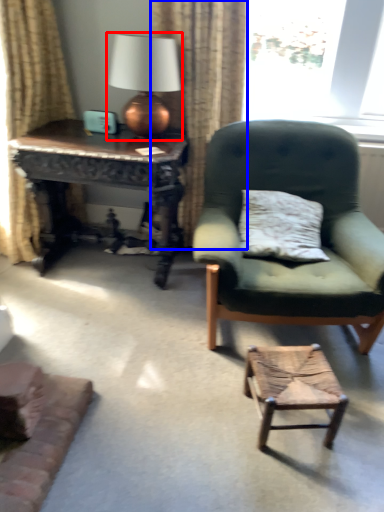
Question: Which object appears closest to the camera in this image, table lamp (highlighted by a red box) or curtain (highlighted by a blue box)?

Choices:
 (A) table lamp
 (B) curtain

Answer: (A)